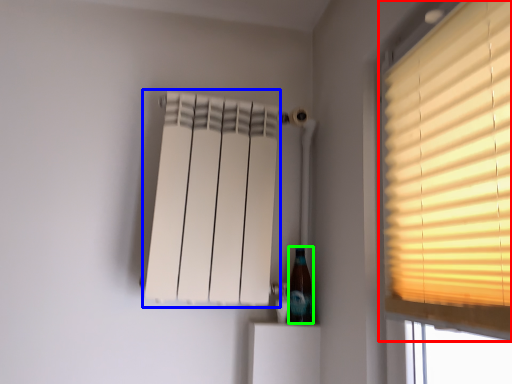
Question: Which is nearer to the window (highlighted by a red box)? curtain (highlighted by a blue box) or bottle (highlighted by a green box).

Choices:
 (A) curtain
 (B) bottle

Answer: (A)